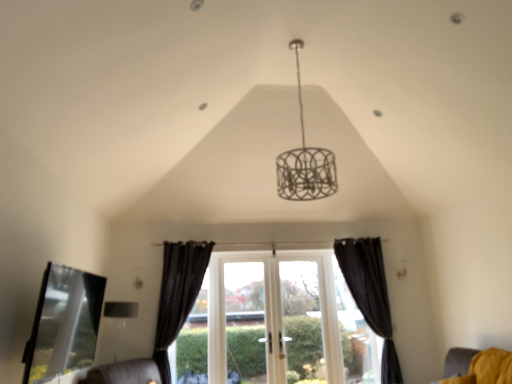
Question: From a real-world perspective, is black matte curtain at right, arranged as the 2th curtain when viewed from the left, above or below matte silver lampshade at lower left?

Choices:
 (A) above
 (B) below

Answer: (A)

Question: Looking at the image, does black matte curtain at right, arranged as the 2th curtain when viewed from the left, seem bigger or smaller compared to matte silver lampshade at lower left?

Choices:
 (A) small
 (B) big

Answer: (B)

Question: Based on their relative distances, which object is nearer to the white glass door at center?

Choices:
 (A) transparent glass bay window at lower left
 (B) black matte curtain at right, which is the 1th curtain from right to left
 (C) white wood window at center
 (D) matte silver lampshade at lower left
 (E) black velvet curtain at center, placed as the 1th curtain when sorted from left to right

Answer: (C)

Question: Estimate the real-world distances between objects in this image. Which object is farther from the white glass screen door at center?

Choices:
 (A) black velvet curtain at center, placed as the 1th curtain when sorted from left to right
 (B) white wood window at center
 (C) transparent glass bay window at lower left
 (D) yellow fabric cushion at lower right
 (E) white glass door at center

Answer: (C)